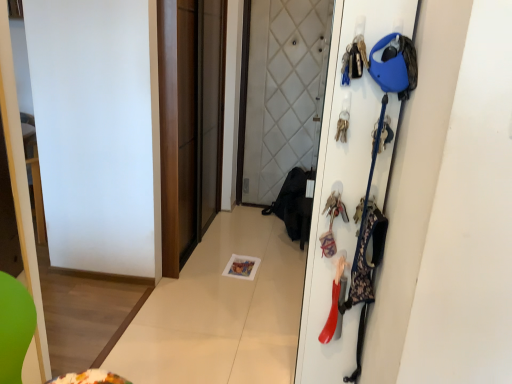
Image resolution: width=512 pixels, height=384 pixels. What are the coordinates of `free space on the front side of brown matte sliding door at center` in the screenshot? It's located at (212, 291).